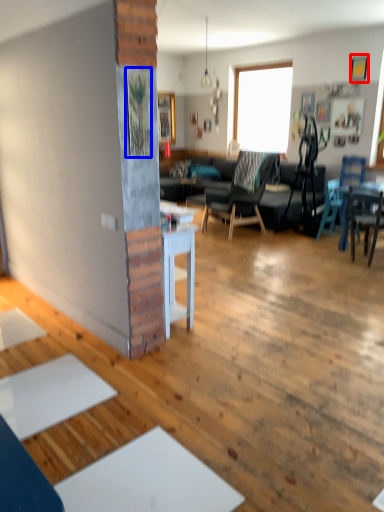
Question: Which of the following is the closest to the observer, picture frame (highlighted by a red box) or picture frame (highlighted by a blue box)?

Choices:
 (A) picture frame
 (B) picture frame

Answer: (B)